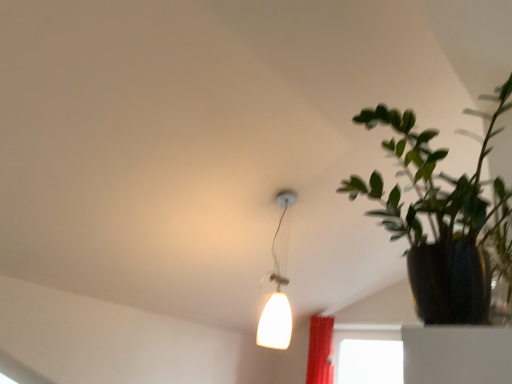
Describe the element at coordinates (278, 289) in the screenshot. The width and height of the screenshot is (512, 384). I see `white glossy lampshade at upper center` at that location.

Locate an element on the screen. Image resolution: width=512 pixels, height=384 pixels. white glossy lampshade at upper center is located at coordinates (278, 289).

What do you see at coordinates (438, 218) in the screenshot?
I see `green matte plant at right` at bounding box center [438, 218].

You are a GUI agent. You are given a task and a screenshot of the screen. Output one action in this format:
    pyautogui.click(x=<x>, y=<y>)
    Task: Click on the green matte plant at right
    
    Given the screenshot: What is the action you would take?
    pyautogui.click(x=438, y=218)

At what (x,y) coordinates should I click in order to perform the action: click on white glossy lampshade at upper center. Please return your answer as a coordinate pair (x, y). Image resolution: width=512 pixels, height=384 pixels. Looking at the image, I should click on [x=278, y=289].

Considering the positions of objects white glossy lampshade at upper center and green matte plant at right in the image provided, who is more to the right, white glossy lampshade at upper center or green matte plant at right?

green matte plant at right.

Does white glossy lampshade at upper center lie behind green matte plant at right?

Yes.

Which is behind, point (273, 250) or point (470, 245)?

The point (273, 250) is farther from the camera.

From the image's perspective, is white glossy lampshade at upper center located above or below green matte plant at right?

Based on their image positions, white glossy lampshade at upper center is located beneath green matte plant at right.

From a real-world perspective, is white glossy lampshade at upper center on top of green matte plant at right?

Correct, in the physical world, white glossy lampshade at upper center is higher than green matte plant at right.

Is white glossy lampshade at upper center wider than green matte plant at right?

In fact, white glossy lampshade at upper center might be narrower than green matte plant at right.

Considering the relative sizes of white glossy lampshade at upper center and green matte plant at right in the image provided, is white glossy lampshade at upper center taller than green matte plant at right?

Correct, white glossy lampshade at upper center is much taller as green matte plant at right.

Between white glossy lampshade at upper center and green matte plant at right, which one has larger size?

green matte plant at right is bigger.

Is white glossy lampshade at upper center surrounding green matte plant at right?

No, green matte plant at right is not inside white glossy lampshade at upper center.

Is white glossy lampshade at upper center directly adjacent to green matte plant at right?

They are not placed beside each other.

Is green matte plant at right at the back of white glossy lampshade at upper center?

No, white glossy lampshade at upper center's orientation is not away from green matte plant at right.

Can you tell me how much white glossy lampshade at upper center and green matte plant at right differ in facing direction?

The facing directions of white glossy lampshade at upper center and green matte plant at right are 94.8 degrees apart.

I want to click on houseplant in front of the white glossy lampshade at upper center, so click(x=438, y=218).

Which object is positioned more to the right, green matte plant at right or white glossy lampshade at upper center?

From the viewer's perspective, green matte plant at right appears more on the right side.

Which object is closer to the camera, green matte plant at right or white glossy lampshade at upper center?

green matte plant at right is more forward.

Which point is more forward, [471,195] or [285,250]?

The point [471,195] is closer to the camera.

From the image's perspective, which one is positioned lower, green matte plant at right or white glossy lampshade at upper center?

white glossy lampshade at upper center.

From a real-world perspective, who is located lower, green matte plant at right or white glossy lampshade at upper center?

green matte plant at right is physically lower.

Which object is thinner, green matte plant at right or white glossy lampshade at upper center?

white glossy lampshade at upper center is thinner.

Which of these two, green matte plant at right or white glossy lampshade at upper center, stands taller?

With more height is white glossy lampshade at upper center.

Which of these two, green matte plant at right or white glossy lampshade at upper center, is smaller?

Smaller between the two is white glossy lampshade at upper center.

Could white glossy lampshade at upper center be considered to be inside green matte plant at right?

No, white glossy lampshade at upper center is not a part of green matte plant at right.

Would you consider green matte plant at right to be distant from white glossy lampshade at upper center?

green matte plant at right is far away from white glossy lampshade at upper center.

In the scene shown: Could you tell me if green matte plant at right is facing white glossy lampshade at upper center?

No, green matte plant at right is not turned towards white glossy lampshade at upper center.

What's the angular difference between green matte plant at right and white glossy lampshade at upper center's facing directions?

The angle between the facing direction of green matte plant at right and the facing direction of white glossy lampshade at upper center is 94.8 degrees.

Measure the distance between green matte plant at right and white glossy lampshade at upper center.

green matte plant at right and white glossy lampshade at upper center are 4.47 feet apart.

Locate an element on the screen. The image size is (512, 384). houseplant located underneath the white glossy lampshade at upper center (from a real-world perspective) is located at coordinates (438, 218).

This screenshot has width=512, height=384. I want to click on houseplant below the white glossy lampshade at upper center (from a real-world perspective), so click(438, 218).

The image size is (512, 384). I want to click on lamp that appears above the green matte plant at right (from a real-world perspective), so pyautogui.click(x=278, y=289).